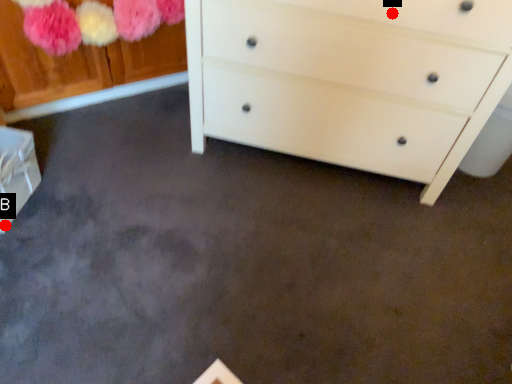
Question: Two points are circled on the image, labeled by A and B beside each circle. Among these points, which one is nearest to the camera?

Choices:
 (A) A is closer
 (B) B is closer

Answer: (A)